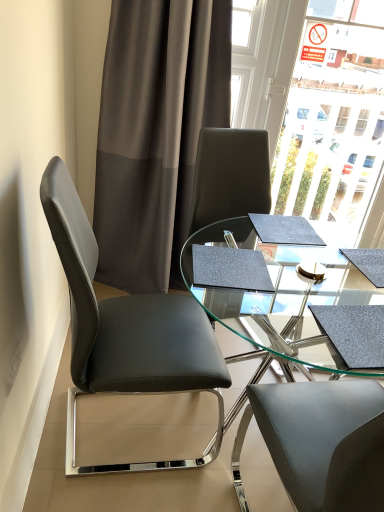
Question: From the image's perspective, relative to black leather chair at left, is transparent glass table at center above or below?

Choices:
 (A) below
 (B) above

Answer: (A)

Question: From a real-world perspective, relative to black leather chair at left, is transparent glass table at center vertically above or below?

Choices:
 (A) below
 (B) above

Answer: (A)

Question: Based on their relative distances, which object is farther from the black leather chair at left?

Choices:
 (A) dark grey sheer curtain at upper left
 (B) transparent glass table at center

Answer: (A)

Question: Which of these objects is positioned closest to the transparent glass table at center?

Choices:
 (A) dark grey sheer curtain at upper left
 (B) black leather chair at left

Answer: (B)